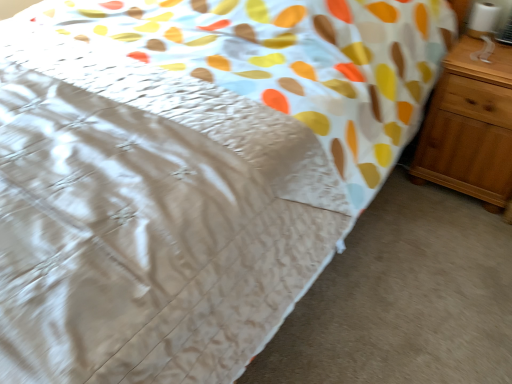
What do you see at coordinates (470, 126) in the screenshot? I see `wooden nightstand at right` at bounding box center [470, 126].

Where is `wooden nightstand at right`? This screenshot has height=384, width=512. wooden nightstand at right is located at coordinates (470, 126).

What is the approximate width of wooden nightstand at right?

The width of wooden nightstand at right is 17.87 inches.

You are a GUI agent. You are given a task and a screenshot of the screen. Output one action in this format:
    pyautogui.click(x=<x>, y=<y>)
    Task: Click on the wooden nightstand at right
    Image resolution: width=512 pixels, height=384 pixels.
    Given the screenshot: What is the action you would take?
    pyautogui.click(x=470, y=126)